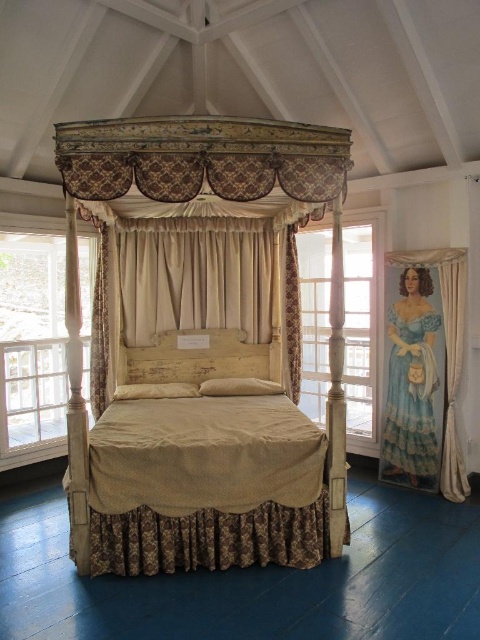
You are an interior designer planning to install a ceiling fan in the room with the wooden canopy bed at center and the beige fabric curtain at center. Considering their heights, which object should you avoid placing the fan too close to?

The wooden canopy bed at center has a greater height compared to the beige fabric curtain at center. Therefore, you should avoid placing the ceiling fan too close to the wooden canopy bed at center to ensure sufficient clearance.

You are standing in front of the white wood window at left in the room with the vintage four poster bed. You want to take a photo of the bed from where you are standing. Is the bed within the camera view? Please explain your reasoning.

The distance between the white wood window at left and the camera is 4.31 meters. Since the bed is the central feature in the room, it is likely positioned further away from the window than the window is from the camera. However, without knowing the bed to camera distance, we can only confirm the window is 4.31 meters away from the camera. The bed might be within view but its exact position relative to the camera isn needed to determine visibility.

You are standing in the room with the vintage four poster bed and want to look out the window. Which object should you move closer to first, the white wood window at left or the beige fabric curtain at right?

You should move closer to the white wood window at left first because it is closer to you than the beige fabric curtain at right.